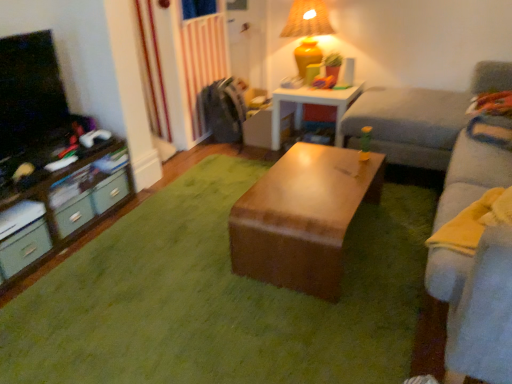
Question: Is wooden table at center, the second table positioned from the bottom, wider than light gray fabric couch at right?

Choices:
 (A) yes
 (B) no

Answer: (A)

Question: Is the surface of wooden table at center, which ranks as the 1th table in back-to-front order, in direct contact with light gray fabric couch at right?

Choices:
 (A) no
 (B) yes

Answer: (A)

Question: Does wooden table at center, the 2th table from the front, have a larger size compared to light gray fabric couch at right?

Choices:
 (A) no
 (B) yes

Answer: (A)

Question: From a real-world perspective, is wooden table at center, the second table positioned from the bottom, on top of light gray fabric couch at right?

Choices:
 (A) no
 (B) yes

Answer: (A)

Question: From a real-world perspective, is wooden table at center, the second table positioned from the bottom, positioned under light gray fabric couch at right based on gravity?

Choices:
 (A) yes
 (B) no

Answer: (A)

Question: From a real-world perspective, is green plastic drawer at left, acting as the 1th drawer starting from the back, above or below matte gray drawer at lower left, placed as the first drawer when sorted from front to back?

Choices:
 (A) above
 (B) below

Answer: (A)

Question: Based on their positions, is green plastic drawer at left, acting as the 1th drawer starting from the back, located to the left or right of matte gray drawer at lower left, placed as the first drawer when sorted from front to back?

Choices:
 (A) left
 (B) right

Answer: (B)

Question: Is point (116, 201) positioned closer to the camera than point (31, 253)?

Choices:
 (A) farther
 (B) closer

Answer: (A)

Question: From the image's perspective, is green plastic drawer at left, acting as the 1th drawer starting from the back, positioned above or below matte gray drawer at lower left, the third drawer in the back-to-front sequence?

Choices:
 (A) above
 (B) below

Answer: (A)

Question: Is matte gray drawer at lower left, placed as the first drawer when sorted from front to back, taller or shorter than light gray fabric couch at right?

Choices:
 (A) tall
 (B) short

Answer: (B)

Question: From the image's perspective, is matte gray drawer at lower left, placed as the first drawer when sorted from front to back, positioned above or below light gray fabric couch at right?

Choices:
 (A) below
 (B) above

Answer: (A)

Question: Based on their positions, is matte gray drawer at lower left, the third drawer in the back-to-front sequence, located to the left or right of light gray fabric couch at right?

Choices:
 (A) left
 (B) right

Answer: (A)

Question: Looking at their shapes, would you say matte gray drawer at lower left, placed as the first drawer when sorted from front to back, is wider or thinner than light gray fabric couch at right?

Choices:
 (A) wide
 (B) thin

Answer: (B)

Question: Considering the positions of point (367, 165) and point (304, 51), is point (367, 165) closer or farther from the camera than point (304, 51)?

Choices:
 (A) farther
 (B) closer

Answer: (B)

Question: Do you think wooden table at center, the 2th table when ordered from top to bottom, is within matte yellow ceramic table lamp at upper right, or outside of it?

Choices:
 (A) inside
 (B) outside

Answer: (B)